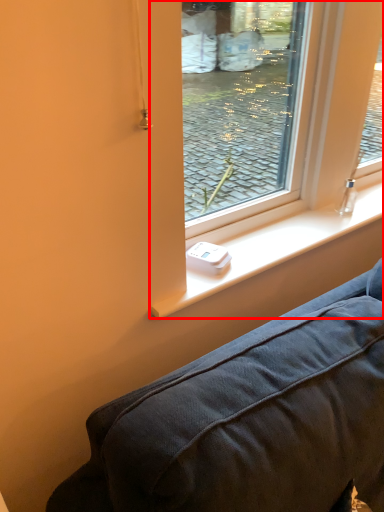
Question: From the image's perspective, where is window screen (annotated by the red box) located relative to window sill?

Choices:
 (A) above
 (B) below

Answer: (A)